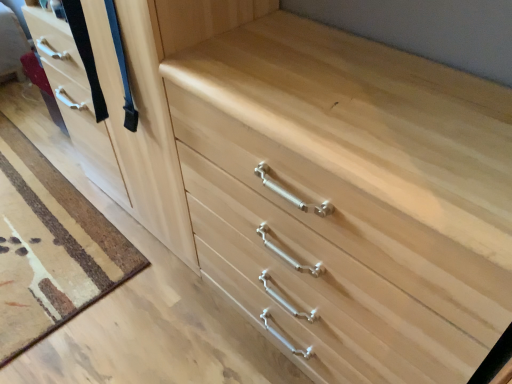
Question: From a real-world perspective, is natural wood drawer at center positioned above or below matte wood door at left?

Choices:
 (A) above
 (B) below

Answer: (B)

Question: Is natural wood drawer at center to the left or to the right of matte wood door at left in the image?

Choices:
 (A) right
 (B) left

Answer: (A)

Question: Is natural wood drawer at center inside or outside of matte wood door at left?

Choices:
 (A) inside
 (B) outside

Answer: (B)

Question: From the image's perspective, is matte wood door at left above or below natural wood drawer at center?

Choices:
 (A) above
 (B) below

Answer: (A)

Question: Considering the positions of point (89, 31) and point (428, 340), is point (89, 31) closer or farther from the camera than point (428, 340)?

Choices:
 (A) farther
 (B) closer

Answer: (A)

Question: From their relative heights in the image, would you say matte wood door at left is taller or shorter than natural wood drawer at center?

Choices:
 (A) tall
 (B) short

Answer: (A)

Question: Looking at their shapes, would you say matte wood door at left is wider or thinner than natural wood drawer at center?

Choices:
 (A) thin
 (B) wide

Answer: (A)